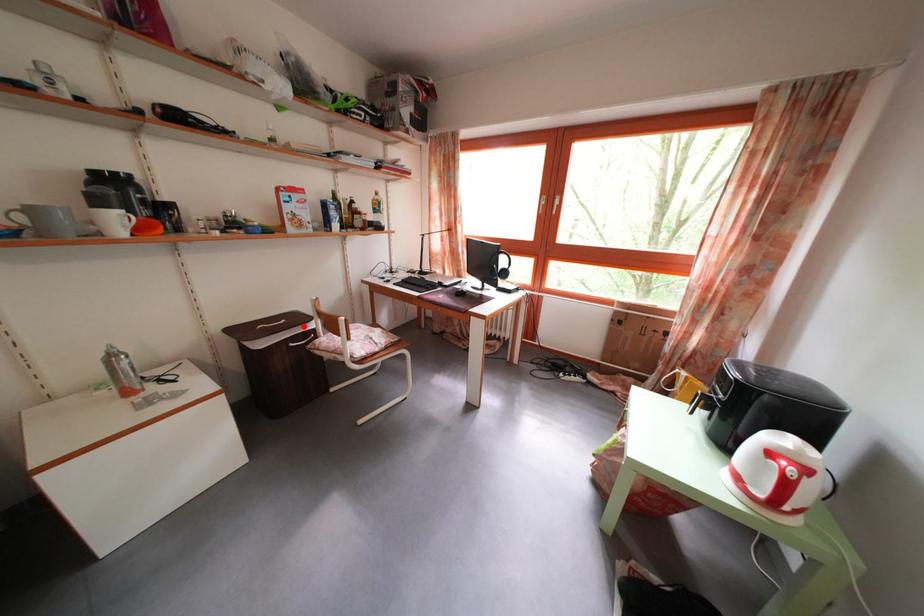
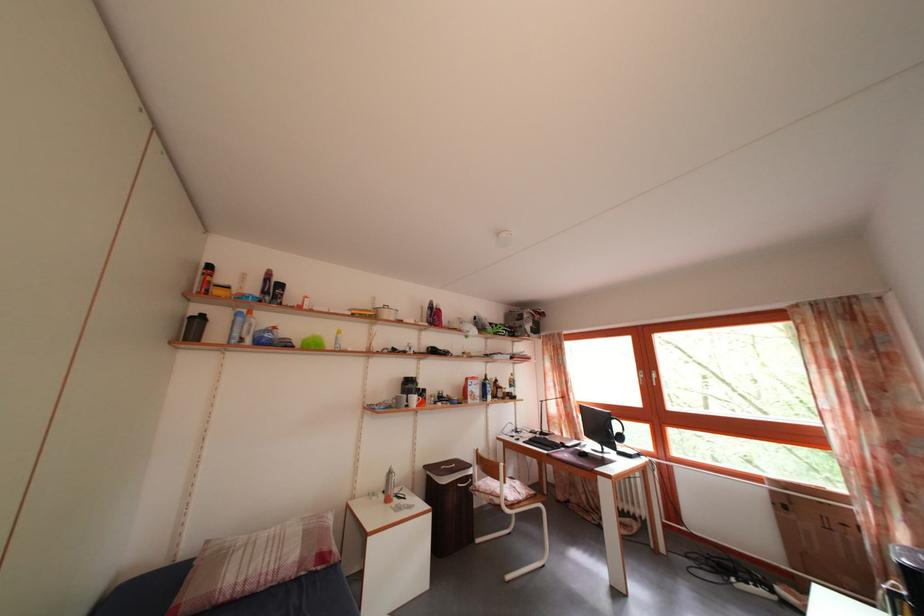
In the second image, find the point that corresponds to the highlighted location in the first image.

(468, 472)